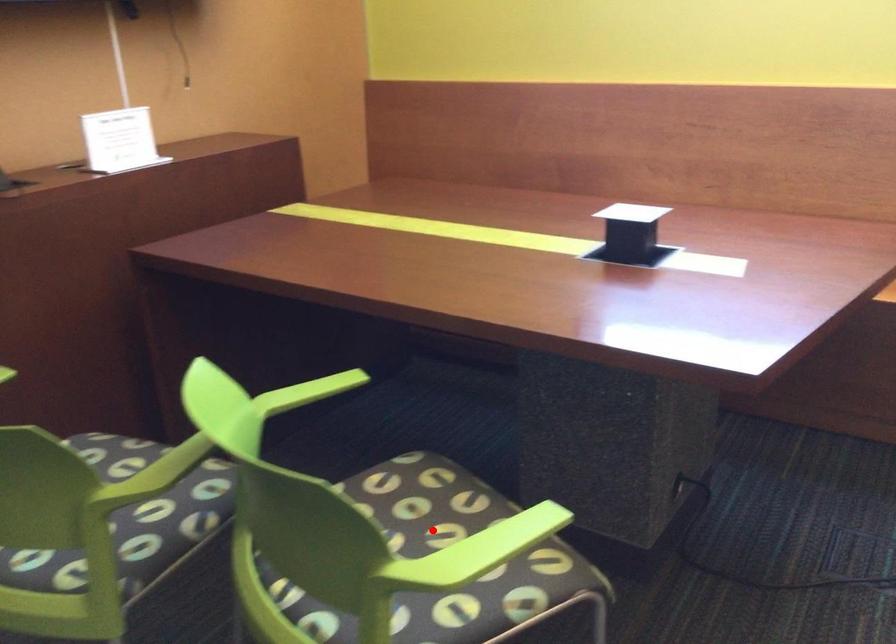
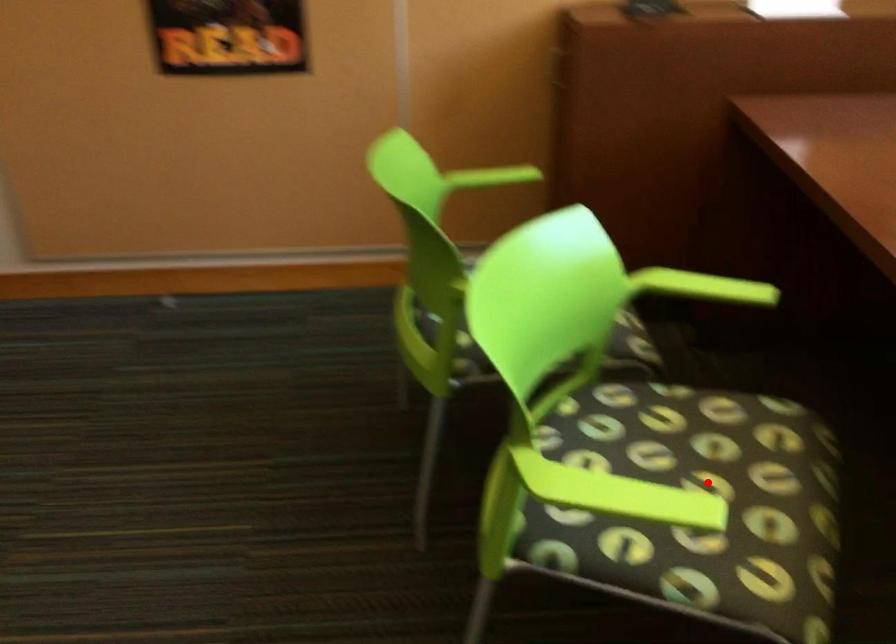
I am providing you with two images of the same scene from different viewpoints. A red point is marked on the first image and another point is marked on the second image. Are the points marked in image1 and image2 representing the same 3D position?

Yes